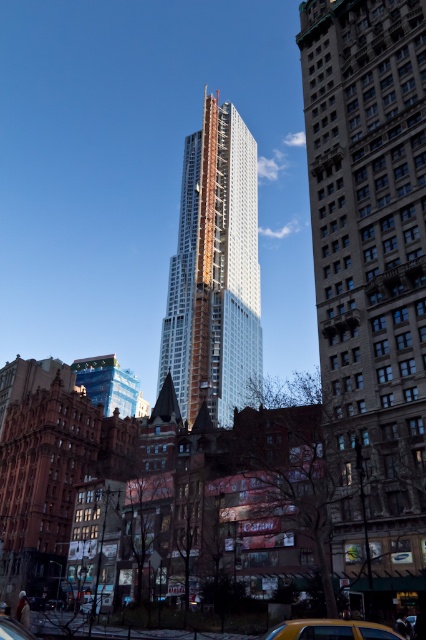
Question: Which point is closer to the camera?

Choices:
 (A) yellow rubber taxi at lower right
 (B) white glass skyscraper at center

Answer: (A)

Question: Is white glass skyscraper at center further to the viewer compared to yellow rubber taxi at lower right?

Choices:
 (A) no
 (B) yes

Answer: (B)

Question: Can you confirm if white glass skyscraper at center is positioned to the left of yellow rubber taxi at lower right?

Choices:
 (A) yes
 (B) no

Answer: (A)

Question: Can you confirm if white glass skyscraper at center is thinner than yellow rubber taxi at lower right?

Choices:
 (A) yes
 (B) no

Answer: (B)